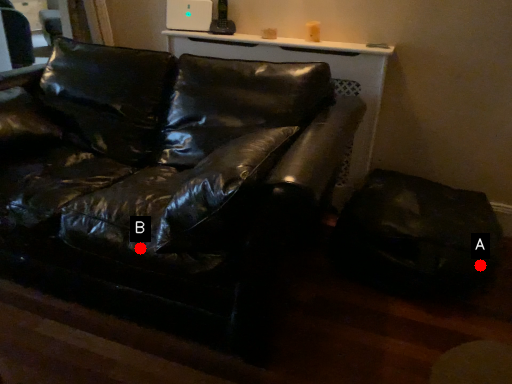
Question: Two points are circled on the image, labeled by A and B beside each circle. Which point appears closest to the camera in this image?

Choices:
 (A) A is closer
 (B) B is closer

Answer: (B)